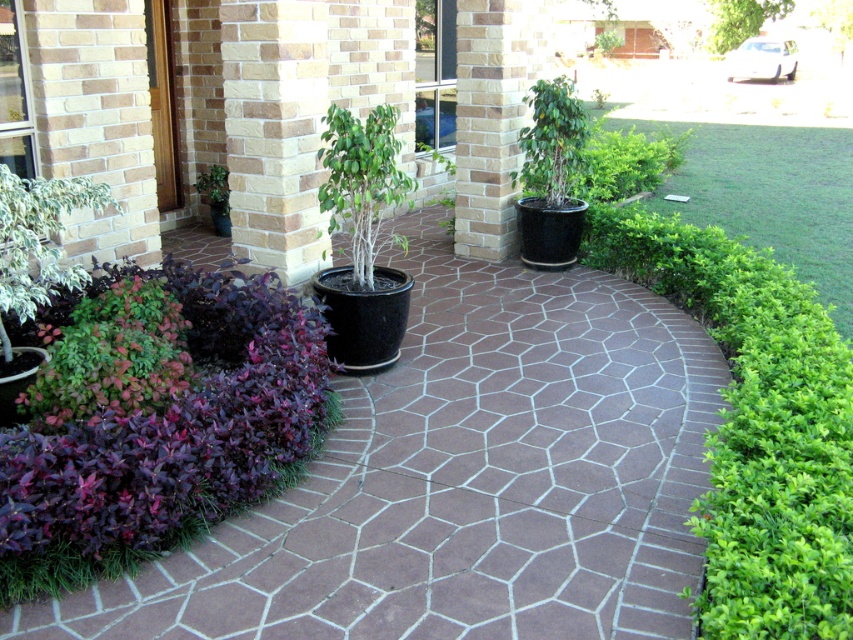
You are designing a garden layout and need to place a new statue that requires a base larger than the brown textured pillar at center. Can the brown textured paving at center accommodate the statue?

The brown textured paving at center is larger in size than the brown textured pillar at center, so it can accommodate the statue requiring a base larger than the pillar.

You are designing a garden layout and want to place a new statue between the green matte tree at center and the green glossy bush at left. Which object should the statue be closer to if it needs to be placed closer to the smaller plant?

The statue should be placed closer to the green matte tree at center since it is the smaller plant compared to the green glossy bush at left.

You are standing at the entrance of the brick building and want to place a new decorative item exactly at the center of the curved pathway. The green matte tree at center is already positioned at coordinates given in the description. Can you determine if the tree is already at the desired location?

The green matte tree at center is located at point (361, 180), which is the center of the curved pathway, so yes, the tree is already at the desired location.